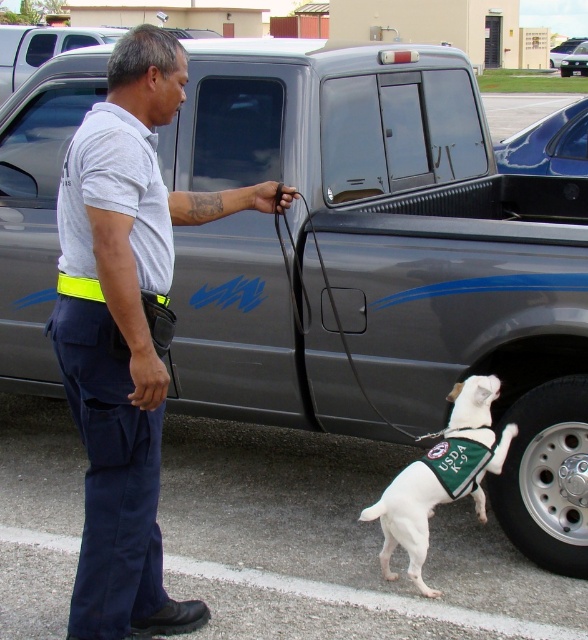
You are a fashion designer observing the scene. You need to determine which item of clothing is taller between the gray cotton shirt at center and the white fabric vest at lower right. Which one is taller?

The gray cotton shirt at center is much taller than the white fabric vest at lower right.

You are a security guard observing the scene. You notice the white fabric vest at lower right and the black rubber leash at center. Which object is nearer to your viewpoint?

The white fabric vest at lower right is closer to the viewer than the black rubber leash at center.